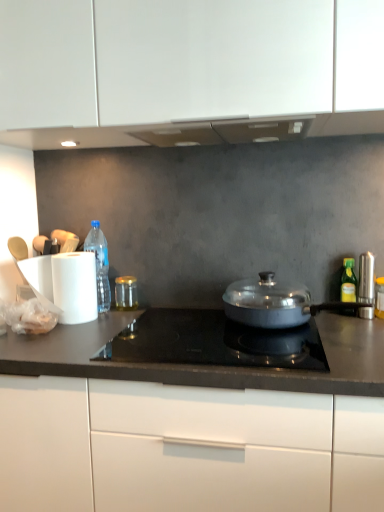
Identify the location of satin silver canister at right. Image resolution: width=384 pixels, height=512 pixels. (366, 278).

What is the approximate height of metallic gray pan at center?

The height of metallic gray pan at center is 5.80 inches.

Describe the element at coordinates (274, 303) in the screenshot. I see `metallic gray pan at center` at that location.

I want to click on yellow-green glass bottle at right, the first bottle positioned from the right, so click(348, 281).

This screenshot has width=384, height=512. I want to click on satin black cooktop at center, so [213, 342].

What is the approximate height of white matte cabinet at center?

The height of white matte cabinet at center is 33.79 inches.

The width and height of the screenshot is (384, 512). What do you see at coordinates (100, 264) in the screenshot?
I see `translucent plastic bottle at left, which ranks as the first bottle in left-to-right order` at bounding box center [100, 264].

At what (x,y) coordinates should I click in order to perform the action: click on satin silver canister at right. Please return your answer as a coordinate pair (x, y). Looking at the image, I should click on (366, 278).

Is satin black cooktop at center oriented towards metallic gray pan at center?

No, satin black cooktop at center is not turned towards metallic gray pan at center.

Considering the relative positions of satin black cooktop at center and metallic gray pan at center in the image provided, is satin black cooktop at center to the left of metallic gray pan at center from the viewer's perspective?

Yes, satin black cooktop at center is to the left of metallic gray pan at center.

Is satin black cooktop at center inside or outside of metallic gray pan at center?

satin black cooktop at center is not enclosed by metallic gray pan at center.

Can you confirm if satin black cooktop at center is thinner than metallic gray pan at center?

In fact, satin black cooktop at center might be wider than metallic gray pan at center.

Is point (102, 236) positioned before point (230, 313)?

No, (102, 236) is further to viewer.

Is translucent plastic bottle at left, the first bottle from the back, looking in the opposite direction of metallic gray pan at center?

No.

Image resolution: width=384 pixels, height=512 pixels. Identify the location of kitchen appliance that appears below the translucent plastic bottle at left, marked as the 2th bottle in a front-to-back arrangement (from a real-world perspective). (274, 303).

From the image's perspective, which one is positioned higher, white matte cabinet at center or metallic gray pan at center?

metallic gray pan at center is shown above in the image.

Are white matte cabinet at center and metallic gray pan at center far apart?

They are positioned close to each other.

Is white matte cabinet at center situated inside metallic gray pan at center or outside?

white matte cabinet at center is located beyond the bounds of metallic gray pan at center.

Who is shorter, white matte cabinet at center or metallic gray pan at center?

metallic gray pan at center.

Is yellow-green glass bottle at right, the second bottle when ordered from back to front, in front of or behind white matte cabinet at center in the image?

In the image, yellow-green glass bottle at right, the second bottle when ordered from back to front, appears behind white matte cabinet at center.

Is yellow-green glass bottle at right, positioned as the 1th bottle in front-to-back order, turned away from white matte cabinet at center?

No, yellow-green glass bottle at right, positioned as the 1th bottle in front-to-back order,'s orientation is not away from white matte cabinet at center.

Is yellow-green glass bottle at right, the first bottle positioned from the right, taller than white matte cabinet at center?

Incorrect, the height of yellow-green glass bottle at right, the first bottle positioned from the right, is not larger of that of white matte cabinet at center.

From the image's perspective, which is above, yellow-green glass bottle at right, the second bottle when ordered from back to front, or white matte cabinet at center?

yellow-green glass bottle at right, the second bottle when ordered from back to front.

The image size is (384, 512). Find the location of `appliance above the white matte cabinet at center (from the image's perspective)`. appliance above the white matte cabinet at center (from the image's perspective) is located at coordinates (366, 278).

Does satin silver canister at right touch white matte cabinet at center?

No, satin silver canister at right is not next to white matte cabinet at center.

Is satin silver canister at right oriented away from white matte cabinet at center?

satin silver canister at right does not have its back to white matte cabinet at center.

Could white matte cabinet at center be considered to be inside satin silver canister at right?

Actually, white matte cabinet at center is outside satin silver canister at right.

From a real-world perspective, is satin silver canister at right positioned over satin black cooktop at center based on gravity?

Yes, from a real-world perspective, satin silver canister at right is above satin black cooktop at center.

Which object is further away from the camera, satin silver canister at right or satin black cooktop at center?

satin silver canister at right is further from the camera.

Considering the sizes of objects satin silver canister at right and satin black cooktop at center in the image provided, who is smaller, satin silver canister at right or satin black cooktop at center?

satin silver canister at right.

Is point (364, 264) closer to camera compared to point (152, 334)?

No, it is behind (152, 334).

Who is bigger, yellow-green glass bottle at right, which is the second bottle in left-to-right order, or metallic gray pan at center?

Bigger between the two is metallic gray pan at center.

Is yellow-green glass bottle at right, the first bottle positioned from the right, aimed at metallic gray pan at center?

Yes, yellow-green glass bottle at right, the first bottle positioned from the right, is turned towards metallic gray pan at center.

Is yellow-green glass bottle at right, positioned as the 1th bottle in front-to-back order, further to the viewer compared to metallic gray pan at center?

That is True.

Where is `kitchen appliance located below the yellow-green glass bottle at right, the first bottle positioned from the right (from the image's perspective)`? This screenshot has height=512, width=384. kitchen appliance located below the yellow-green glass bottle at right, the first bottle positioned from the right (from the image's perspective) is located at coordinates (274, 303).

I want to click on kitchen appliance on the right side of satin black cooktop at center, so click(x=274, y=303).

Find the location of a particular element. kitchen appliance below the translucent plastic bottle at left, which is counted as the second bottle, starting from the right (from a real-world perspective) is located at coordinates (274, 303).

Which object lies further to the anchor point satin silver canister at right, satin black cooktop at center or yellow-green glass bottle at right, the second bottle when ordered from back to front?

Among the two, satin black cooktop at center is located further to satin silver canister at right.

Estimate the real-world distances between objects in this image. Which object is further from yellow-green glass bottle at right, which is the second bottle in left-to-right order, metallic gray pan at center or satin silver canister at right?

Based on the image, metallic gray pan at center appears to be further to yellow-green glass bottle at right, which is the second bottle in left-to-right order.

Looking at the image, which one is located closer to translucent plastic bottle at left, which ranks as the first bottle in left-to-right order, metallic gray pan at center or satin black cooktop at center?

Based on the image, satin black cooktop at center appears to be nearer to translucent plastic bottle at left, which ranks as the first bottle in left-to-right order.

Looking at the image, which one is located further to translucent plastic bottle at left, the first bottle from the back, yellow-green glass bottle at right, the second bottle when ordered from back to front, or metallic gray pan at center?

The object further to translucent plastic bottle at left, the first bottle from the back, is yellow-green glass bottle at right, the second bottle when ordered from back to front.

Consider the image. Which object lies further to the anchor point metallic gray pan at center, yellow-green glass bottle at right, the second bottle when ordered from back to front, or satin black cooktop at center?

yellow-green glass bottle at right, the second bottle when ordered from back to front, is positioned further to the anchor metallic gray pan at center.

Considering their positions, is satin silver canister at right positioned further to translucent plastic bottle at left, which is counted as the second bottle, starting from the right, than yellow-green glass bottle at right, the first bottle positioned from the right?

The object further to translucent plastic bottle at left, which is counted as the second bottle, starting from the right, is satin silver canister at right.

From the image, which object appears to be farther from white matte cabinet at center, satin silver canister at right or satin black cooktop at center?

The object further to white matte cabinet at center is satin silver canister at right.

From the picture: Which object lies nearer to the anchor point translucent plastic bottle at left, the first bottle from the back, metallic gray pan at center or satin silver canister at right?

Based on the image, metallic gray pan at center appears to be nearer to translucent plastic bottle at left, the first bottle from the back.

Identify the location of gas stove between white matte cabinet at center and translucent plastic bottle at left, the first bottle from the back, in the front-back direction. This screenshot has height=512, width=384. (213, 342).

Identify the location of kitchen appliance situated between translucent plastic bottle at left, the first bottle from the back, and satin silver canister at right from left to right. (274, 303).

Locate an element on the screen. This screenshot has width=384, height=512. cabinetry between translucent plastic bottle at left, which ranks as the first bottle in left-to-right order, and metallic gray pan at center from left to right is located at coordinates (185, 448).

Where is `gas stove located between translucent plastic bottle at left, which is counted as the second bottle, starting from the right, and metallic gray pan at center in the left-right direction`? The width and height of the screenshot is (384, 512). gas stove located between translucent plastic bottle at left, which is counted as the second bottle, starting from the right, and metallic gray pan at center in the left-right direction is located at coordinates (213, 342).